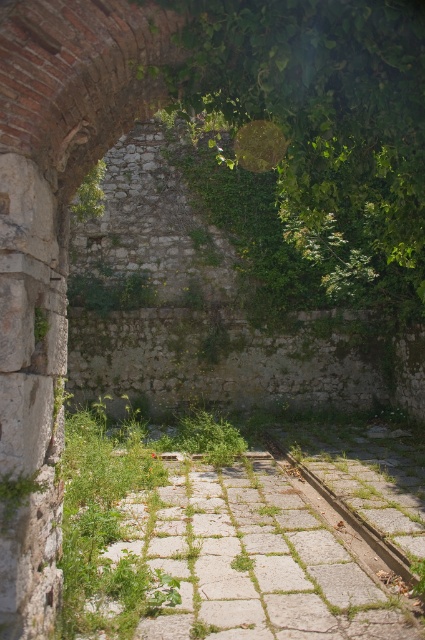
Question: Can you confirm if gray stone path at center is smaller than gray concrete train track at center?

Choices:
 (A) yes
 (B) no

Answer: (B)

Question: Which point is farther to the camera?

Choices:
 (A) (384, 545)
 (B) (210, 602)

Answer: (A)

Question: Does gray stone path at center have a larger size compared to gray concrete train track at center?

Choices:
 (A) no
 (B) yes

Answer: (B)

Question: In this image, where is gray stone path at center located relative to gray concrete train track at center?

Choices:
 (A) right
 (B) left

Answer: (B)